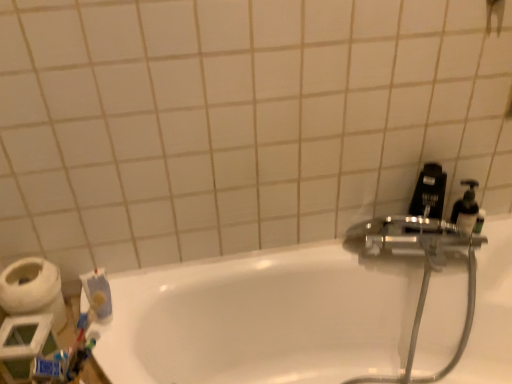
This screenshot has height=384, width=512. What do you see at coordinates (33, 290) in the screenshot?
I see `white matte toilet paper at lower left` at bounding box center [33, 290].

Image resolution: width=512 pixels, height=384 pixels. What are the coordinates of `blue matte toothpaste at lower left` in the screenshot? It's located at (98, 294).

Between point (480, 362) and point (102, 300), which one is positioned in front?

Positioned in front is point (102, 300).

Is white glossy bathtub at center aimed at blue matte toothpaste at lower left?

No, white glossy bathtub at center does not turn towards blue matte toothpaste at lower left.

Considering the relative sizes of white glossy bathtub at center and blue matte toothpaste at lower left in the image provided, is white glossy bathtub at center wider than blue matte toothpaste at lower left?

Correct, the width of white glossy bathtub at center exceeds that of blue matte toothpaste at lower left.

Is blue matte toothpaste at lower left not close to white matte toilet paper at lower left?

No, there isn't a large distance between blue matte toothpaste at lower left and white matte toilet paper at lower left.

Is blue matte toothpaste at lower left at the left side of white matte toilet paper at lower left?

No.

How different are the orientations of blue matte toothpaste at lower left and white matte toilet paper at lower left in degrees?

19.1 degrees.

Which of these two, blue matte toothpaste at lower left or white matte toilet paper at lower left, is bigger?

Bigger between the two is white matte toilet paper at lower left.

From a real-world perspective, between white matte toilet paper at lower left and shiny metallic hose at upper right, who is vertically lower?

In real-world perspective, shiny metallic hose at upper right is lower.

Which object is positioned more to the right, white matte toilet paper at lower left or shiny metallic hose at upper right?

shiny metallic hose at upper right.

How much distance is there between white matte toilet paper at lower left and shiny metallic hose at upper right?

The distance of white matte toilet paper at lower left from shiny metallic hose at upper right is 35.79 inches.

Can you confirm if white matte toilet paper at lower left is wider than shiny metallic hose at upper right?

Incorrect, the width of white matte toilet paper at lower left does not surpass that of shiny metallic hose at upper right.

From a real-world perspective, is white glossy bathtub at center on shiny metallic hose at upper right?

No, from a real-world perspective, white glossy bathtub at center is not above shiny metallic hose at upper right.

Considering the sizes of objects white glossy bathtub at center and shiny metallic hose at upper right in the image provided, who is wider, white glossy bathtub at center or shiny metallic hose at upper right?

white glossy bathtub at center.

Find the location of a particular element. This screenshot has height=384, width=512. garden hose that appears above the white glossy bathtub at center (from the image's perspective) is located at coordinates (x=418, y=331).

Is white glossy bathtub at center oriented away from shiny metallic hose at upper right?

Yes, shiny metallic hose at upper right is at the back of white glossy bathtub at center.

Between point (435, 217) and point (267, 296), which one is positioned in front?

The point (435, 217) is closer.

Between black plastic soap dispenser at right and white glossy bathtub at center, which one has smaller size?

Smaller between the two is black plastic soap dispenser at right.

How many degrees apart are the facing directions of black plastic soap dispenser at right and white glossy bathtub at center?

They differ by 22.3 degrees in their facing directions.

Are black plastic soap dispenser at right and white glossy bathtub at center located far from each other?

Actually, black plastic soap dispenser at right and white glossy bathtub at center are a little close together.

Identify the location of toilet paper that appears below the blue matte toothpaste at lower left (from the image's perspective). (33, 290).

In the scene shown: Between white matte toilet paper at lower left and blue matte toothpaste at lower left, which one has less height?

With less height is blue matte toothpaste at lower left.

Considering the positions of points (20, 267) and (106, 298), is point (20, 267) farther from camera compared to point (106, 298)?

That is True.

From the image's perspective, between white matte toilet paper at lower left and blue matte toothpaste at lower left, who is located below?

white matte toilet paper at lower left, from the image's perspective.

In the scene shown: Is blue matte toothpaste at lower left smaller than black plastic soap dispenser at right?

Yes.

From the image's perspective, is blue matte toothpaste at lower left beneath black plastic soap dispenser at right?

Yes, from the image's perspective, blue matte toothpaste at lower left is below black plastic soap dispenser at right.

Which of these two, blue matte toothpaste at lower left or black plastic soap dispenser at right, is thinner?

Thinner between the two is blue matte toothpaste at lower left.

Is blue matte toothpaste at lower left oriented away from black plastic soap dispenser at right?

That's not correct — blue matte toothpaste at lower left is not looking away from black plastic soap dispenser at right.

The width and height of the screenshot is (512, 384). I want to click on bathtub that appears on the right of blue matte toothpaste at lower left, so click(262, 319).

Where is `toilet paper directly beneath the blue matte toothpaste at lower left (from a real-world perspective)`? The width and height of the screenshot is (512, 384). toilet paper directly beneath the blue matte toothpaste at lower left (from a real-world perspective) is located at coordinates (33, 290).

Which object lies further to the anchor point white glossy bathtub at center, shiny metallic hose at upper right or white matte toilet paper at lower left?

Based on the image, white matte toilet paper at lower left appears to be further to white glossy bathtub at center.

Based on their spatial positions, is shiny metallic hose at upper right or white glossy bathtub at center closer to black plastic soap dispenser at right?

shiny metallic hose at upper right is positioned closer to the anchor black plastic soap dispenser at right.

From the image, which object appears to be farther from white glossy bathtub at center, white matte toilet paper at lower left or shiny metallic hose at upper right?

white matte toilet paper at lower left is positioned further to the anchor white glossy bathtub at center.

When comparing their distances from shiny metallic hose at upper right, does blue matte toothpaste at lower left or black plastic soap dispenser at right seem further?

blue matte toothpaste at lower left is positioned further to the anchor shiny metallic hose at upper right.

Looking at this image, looking at the image, which one is located closer to blue matte toothpaste at lower left, white glossy bathtub at center or shiny metallic hose at upper right?

white glossy bathtub at center lies closer to blue matte toothpaste at lower left than the other object.

Estimate the real-world distances between objects in this image. Which object is closer to white matte toilet paper at lower left, shiny metallic hose at upper right or black plastic soap dispenser at right?

shiny metallic hose at upper right.

From the image, which object appears to be nearer to white matte toilet paper at lower left, shiny metallic hose at upper right or white glossy bathtub at center?

white glossy bathtub at center is positioned closer to the anchor white matte toilet paper at lower left.

Based on their spatial positions, is black plastic soap dispenser at right or white matte toilet paper at lower left further from shiny metallic hose at upper right?

white matte toilet paper at lower left lies further to shiny metallic hose at upper right than the other object.

What are the coordinates of `garden hose between black plastic soap dispenser at right and white glossy bathtub at center vertically` in the screenshot? It's located at (418, 331).

The image size is (512, 384). Find the location of `bathtub between white matte toilet paper at lower left and shiny metallic hose at upper right from left to right`. bathtub between white matte toilet paper at lower left and shiny metallic hose at upper right from left to right is located at coordinates click(262, 319).

You are a GUI agent. You are given a task and a screenshot of the screen. Output one action in this format:
    pyautogui.click(x=<x>, y=<y>)
    Task: Click on the bathtub between blue matte toothpaste at lower left and black plastic soap dispenser at right
    
    Given the screenshot: What is the action you would take?
    pyautogui.click(x=262, y=319)

Where is `garden hose located between blue matte toothpaste at lower left and black plastic soap dispenser at right in the left-right direction`? The image size is (512, 384). garden hose located between blue matte toothpaste at lower left and black plastic soap dispenser at right in the left-right direction is located at coordinates (418, 331).